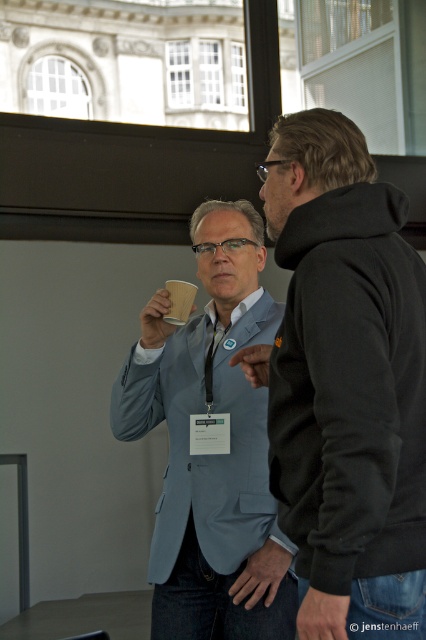
Is the position of matte gray blazer at center more distant than that of brown paper cup at upper center?

No, matte gray blazer at center is in front of brown paper cup at upper center.

Is matte gray blazer at center shorter than brown paper cup at upper center?

No.

Between point (209, 461) and point (169, 304), which one is positioned in front?

Point (209, 461) is in front.

You are a GUI agent. You are given a task and a screenshot of the screen. Output one action in this format:
    pyautogui.click(x=<x>, y=<y>)
    Task: Click on the matte gray blazer at center
    The height and width of the screenshot is (640, 426).
    Given the screenshot: What is the action you would take?
    pyautogui.click(x=213, y=452)

Is point (210, 428) positioned before point (325, 596)?

That is False.

Identify the location of matte gray blazer at center. Image resolution: width=426 pixels, height=640 pixels. (213, 452).

Is point (334, 502) in front of point (336, 624)?

No.

Is black hoodie at right positioned behind dark gray fabric hand at lower right?

Yes, black hoodie at right is behind dark gray fabric hand at lower right.

Is point (273, 420) more distant than point (304, 621)?

Yes, it is behind point (304, 621).

Identify the location of black hoodie at right. (348, 376).